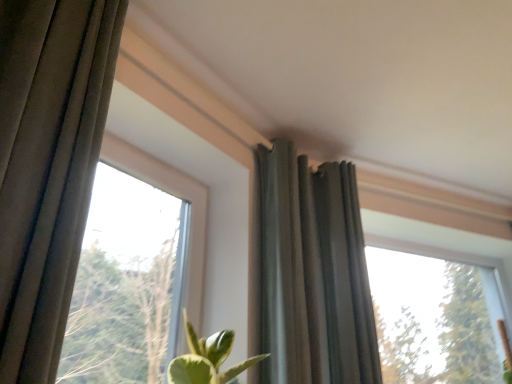
Question: From a real-world perspective, is transparent glass window at upper right, the 1th window positioned from the back, positioned above or below transparent glass window at upper left, which appears as the 2th window when viewed from the back?

Choices:
 (A) above
 (B) below

Answer: (A)

Question: In terms of size, does transparent glass window at upper right, marked as the 1th window in a right-to-left arrangement, appear bigger or smaller than transparent glass window at upper left, arranged as the second window when viewed from the right?

Choices:
 (A) big
 (B) small

Answer: (A)

Question: Which is nearer to the transparent glass window at upper right, the 2th window in the left-to-right sequence?

Choices:
 (A) dark gray fabric curtain at upper center
 (B) transparent glass window at upper left, the first window viewed from the front

Answer: (A)

Question: Which object is positioned farthest from the dark gray fabric curtain at upper center?

Choices:
 (A) transparent glass window at upper right, the 1th window positioned from the back
 (B) transparent glass window at upper left, which is the first window from left to right

Answer: (A)